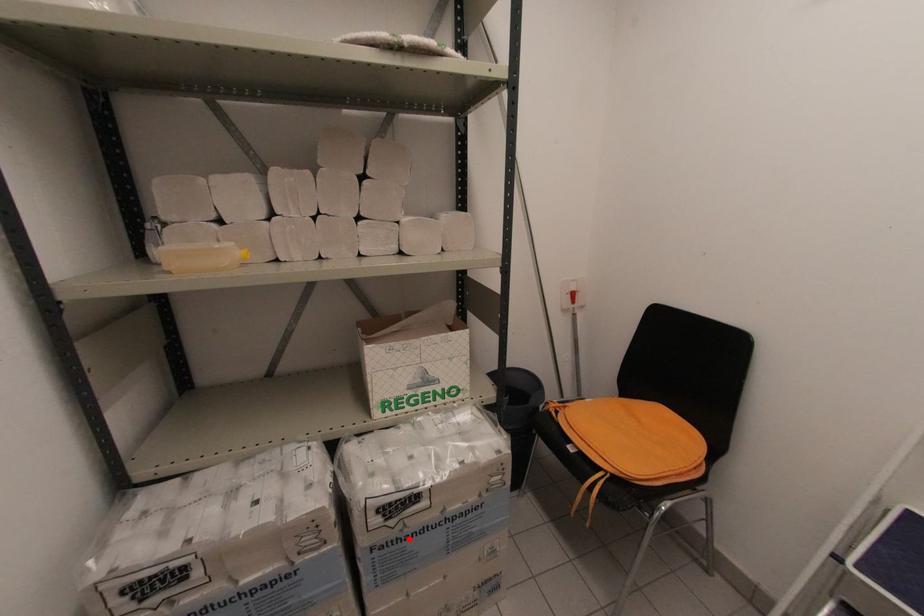
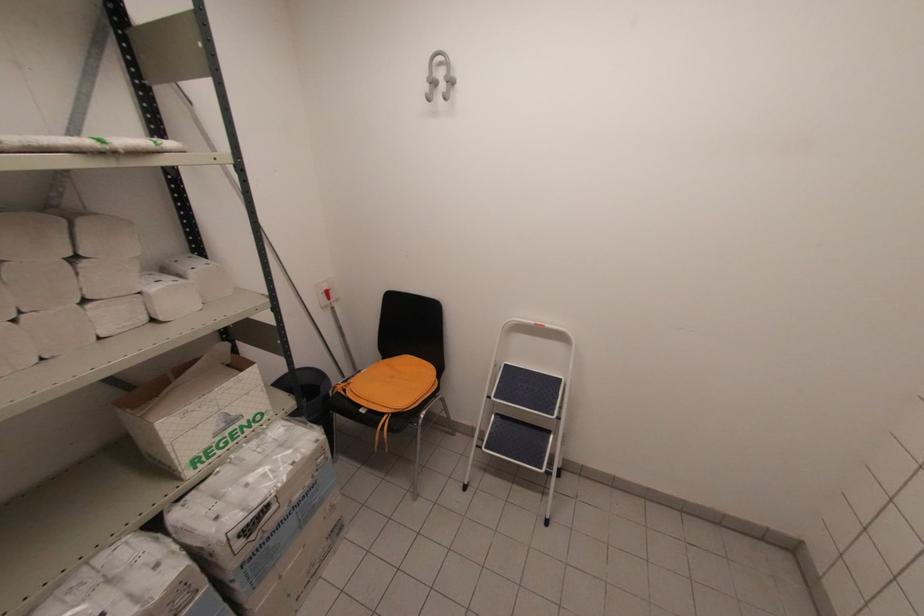
Question: I am providing you with two images of the same scene from different viewpoints. Image1 has a red point marked. In image2, the corresponding 3D location appears at what relative position? Reply with the corresponding letter.

Choices:
 (A) Closer
 (B) Farther

Answer: (A)